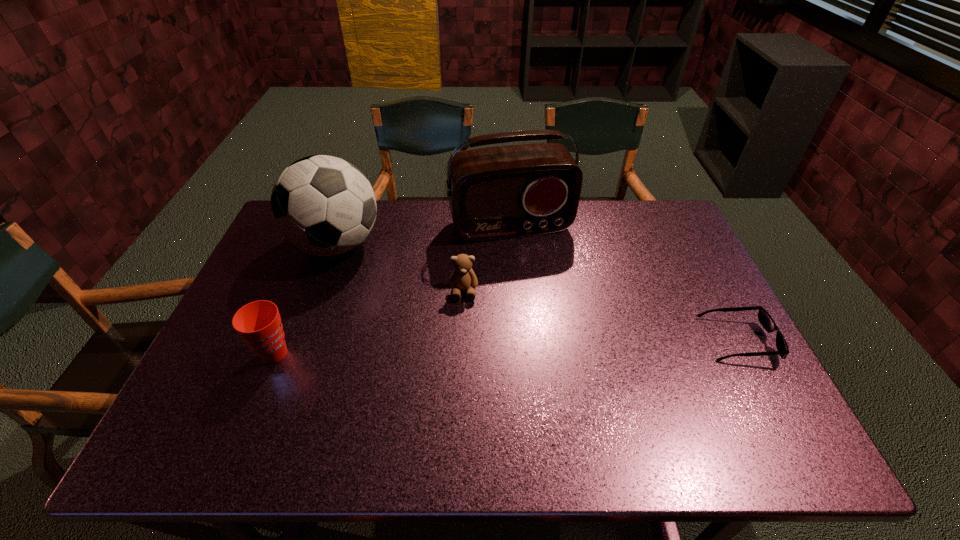
Find the location of a particular element. This screenshot has height=540, width=960. free space in the image that satisfies the following two spatial constraints: 1. on the back side of the cup; 2. on the front-facing side of the sunglasses is located at coordinates (280, 341).

Where is `vacant space that satisfies the following two spatial constraints: 1. on the front side of the rightmost object; 2. on the front-facing side of the third nearest object`? vacant space that satisfies the following two spatial constraints: 1. on the front side of the rightmost object; 2. on the front-facing side of the third nearest object is located at coordinates (462, 341).

I want to click on vacant space that satisfies the following two spatial constraints: 1. on the front side of the rightmost object; 2. on the front-facing side of the radio receiver, so click(519, 341).